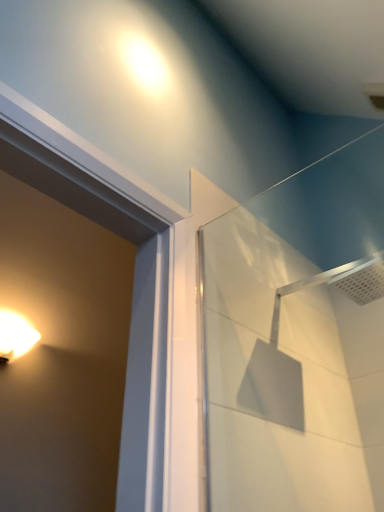
What is the approximate width of silver metallic shower head at upper right?

silver metallic shower head at upper right is 16.39 inches wide.

Identify the location of silver metallic shower head at upper right. The height and width of the screenshot is (512, 384). (349, 280).

What do you see at coordinates (349, 280) in the screenshot? I see `silver metallic shower head at upper right` at bounding box center [349, 280].

The height and width of the screenshot is (512, 384). I want to click on silver metallic shower head at upper right, so click(349, 280).